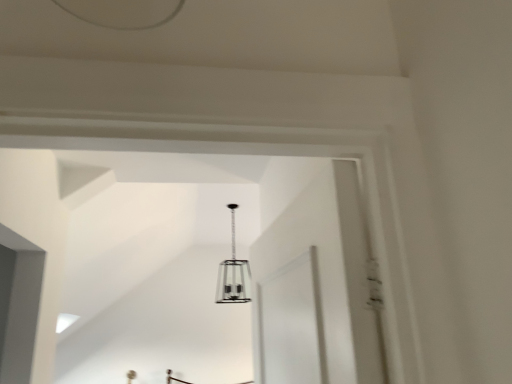
You are a GUI agent. You are given a task and a screenshot of the screen. Output one action in this format:
    pyautogui.click(x=<x>, y=<y>)
    Task: Click on the clear glass pendant light at center
    This screenshot has height=384, width=512.
    Given the screenshot: What is the action you would take?
    pyautogui.click(x=233, y=274)

What do you see at coordinates (233, 274) in the screenshot?
I see `clear glass pendant light at center` at bounding box center [233, 274].

Find the location of a particular element. clear glass pendant light at center is located at coordinates (233, 274).